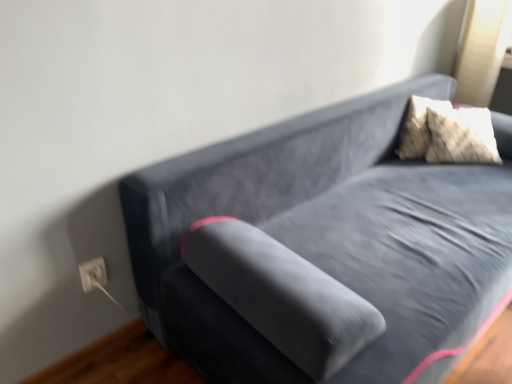
At what (x,y) coordinates should I click in order to perform the action: click on brown wood flooring at lower left. Please return your answer as a coordinate pair (x, y). This screenshot has height=384, width=512. Looking at the image, I should click on (120, 362).

What do you see at coordinates (120, 362) in the screenshot?
I see `brown wood flooring at lower left` at bounding box center [120, 362].

Looking at this image, measure the distance between brown wood flooring at lower left and camera.

They are 1.45 meters apart.

This screenshot has width=512, height=384. What do you see at coordinates (93, 274) in the screenshot?
I see `white plastic electric outlet at lower left` at bounding box center [93, 274].

This screenshot has width=512, height=384. I want to click on white plastic electric outlet at lower left, so click(x=93, y=274).

Identify the location of brown wood flooring at lower left. (120, 362).

Is brown wood flooring at lower left to the left or to the right of white plastic electric outlet at lower left in the image?

Clearly, brown wood flooring at lower left is on the left of white plastic electric outlet at lower left in the image.

Is brown wood flooring at lower left closer to camera compared to white plastic electric outlet at lower left?

Yes, it is in front of white plastic electric outlet at lower left.

Is point (135, 370) positioned after point (79, 270)?

Yes.

From the image's perspective, is brown wood flooring at lower left positioned above or below white plastic electric outlet at lower left?

Clearly, from the image's perspective, brown wood flooring at lower left is below white plastic electric outlet at lower left.

From a real-world perspective, is brown wood flooring at lower left physically below white plastic electric outlet at lower left?

Correct, in the physical world, brown wood flooring at lower left is lower than white plastic electric outlet at lower left.

Which of these two, brown wood flooring at lower left or white plastic electric outlet at lower left, is thinner?

With smaller width is white plastic electric outlet at lower left.

Does brown wood flooring at lower left have a lesser height compared to white plastic electric outlet at lower left?

Correct, brown wood flooring at lower left is not as tall as white plastic electric outlet at lower left.

Can you confirm if brown wood flooring at lower left is bigger than white plastic electric outlet at lower left?

Correct, brown wood flooring at lower left is larger in size than white plastic electric outlet at lower left.

Could white plastic electric outlet at lower left be considered to be inside brown wood flooring at lower left?

Actually, white plastic electric outlet at lower left is outside brown wood flooring at lower left.

Is brown wood flooring at lower left far away from white plastic electric outlet at lower left?

brown wood flooring at lower left is near white plastic electric outlet at lower left, not far away.

Is brown wood flooring at lower left facing away from white plastic electric outlet at lower left?

brown wood flooring at lower left does not have its back to white plastic electric outlet at lower left.

Can you tell me how much brown wood flooring at lower left and white plastic electric outlet at lower left differ in facing direction?

0.182 degrees.

How much distance is there between brown wood flooring at lower left and white plastic electric outlet at lower left?

brown wood flooring at lower left is 30.96 centimeters from white plastic electric outlet at lower left.

This screenshot has width=512, height=384. What are the coordinates of `hardwood that is under the white plastic electric outlet at lower left (from a real-world perspective)` in the screenshot? It's located at click(120, 362).

Looking at this image, can you confirm if white plastic electric outlet at lower left is positioned to the left of brown wood flooring at lower left?

No.

Is white plastic electric outlet at lower left behind brown wood flooring at lower left?

Yes, it is behind brown wood flooring at lower left.

Considering the positions of point (102, 266) and point (65, 369), is point (102, 266) closer or farther from the camera than point (65, 369)?

Point (102, 266) appears to be closer to the viewer than point (65, 369).

From the image's perspective, relative to brown wood flooring at lower left, is white plastic electric outlet at lower left above or below?

Clearly, from the image's perspective, white plastic electric outlet at lower left is above brown wood flooring at lower left.

From a real-world perspective, is white plastic electric outlet at lower left physically below brown wood flooring at lower left?

No, from a real-world perspective, white plastic electric outlet at lower left is not below brown wood flooring at lower left.

Looking at their sizes, would you say white plastic electric outlet at lower left is wider or thinner than brown wood flooring at lower left?

white plastic electric outlet at lower left is thinner than brown wood flooring at lower left.

Which of these two, white plastic electric outlet at lower left or brown wood flooring at lower left, stands shorter?

With less height is brown wood flooring at lower left.

Is white plastic electric outlet at lower left smaller than brown wood flooring at lower left?

Correct, white plastic electric outlet at lower left occupies less space than brown wood flooring at lower left.

Could brown wood flooring at lower left be considered to be inside white plastic electric outlet at lower left?

Actually, brown wood flooring at lower left is outside white plastic electric outlet at lower left.

Are white plastic electric outlet at lower left and brown wood flooring at lower left far apart?

That's not correct — white plastic electric outlet at lower left is a little close to brown wood flooring at lower left.

Could you tell me if white plastic electric outlet at lower left is facing brown wood flooring at lower left?

No, white plastic electric outlet at lower left is not aimed at brown wood flooring at lower left.

Can you tell me how much white plastic electric outlet at lower left and brown wood flooring at lower left differ in facing direction?

white plastic electric outlet at lower left and brown wood flooring at lower left are facing 0.182 degrees away from each other.

The image size is (512, 384). I want to click on electric outlet located behind the brown wood flooring at lower left, so tap(93, 274).

Find the location of a particular element. This screenshot has height=384, width=512. electric outlet lying behind the brown wood flooring at lower left is located at coordinates (93, 274).

Find the location of a particular element. electric outlet above the brown wood flooring at lower left (from a real-world perspective) is located at coordinates (93, 274).